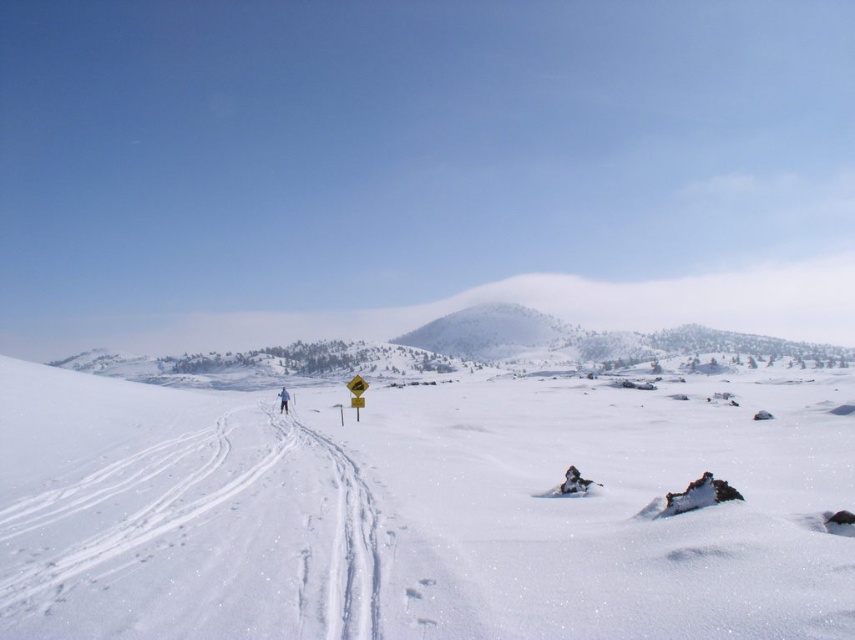
Question: Which object appears closest to the camera in this image?

Choices:
 (A) white snow ski slope at center
 (B) white snow-covered mountain at center

Answer: (A)

Question: Does white snow ski slope at center appear on the left side of white snow-covered mountain at center?

Choices:
 (A) yes
 (B) no

Answer: (A)

Question: Is white snow ski slope at center bigger than white snow-covered mountain at center?

Choices:
 (A) no
 (B) yes

Answer: (B)

Question: Which of these objects is positioned farthest from the white snow-covered mountain at center?

Choices:
 (A) blue fabric jacket at center
 (B) white snow ski slope at center

Answer: (B)

Question: Does white snow ski slope at center have a greater width compared to white snow-covered mountain at center?

Choices:
 (A) yes
 (B) no

Answer: (A)

Question: Which of the following is the farthest from the observer?

Choices:
 (A) blue fabric jacket at center
 (B) white snow-covered mountain at center

Answer: (B)